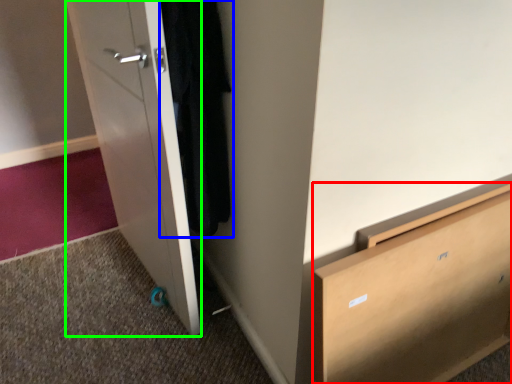
Question: Which object is positioned closest to chest of drawers (highlighted by a red box)? Select from clothing (highlighted by a blue box) and door (highlighted by a green box).

Choices:
 (A) clothing
 (B) door

Answer: (A)